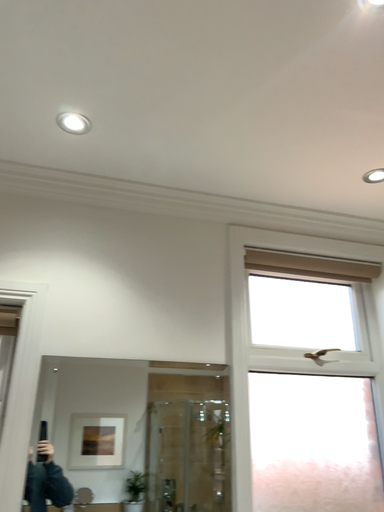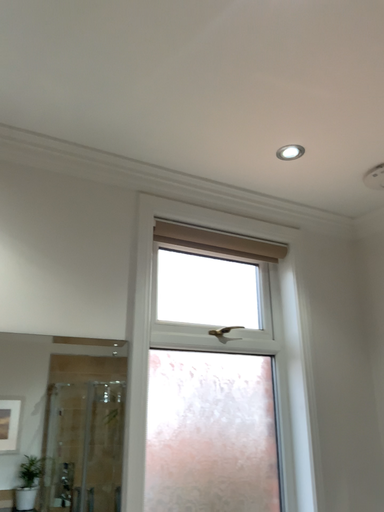
Question: How did the camera likely rotate when shooting the video?

Choices:
 (A) rotated right
 (B) rotated left

Answer: (A)